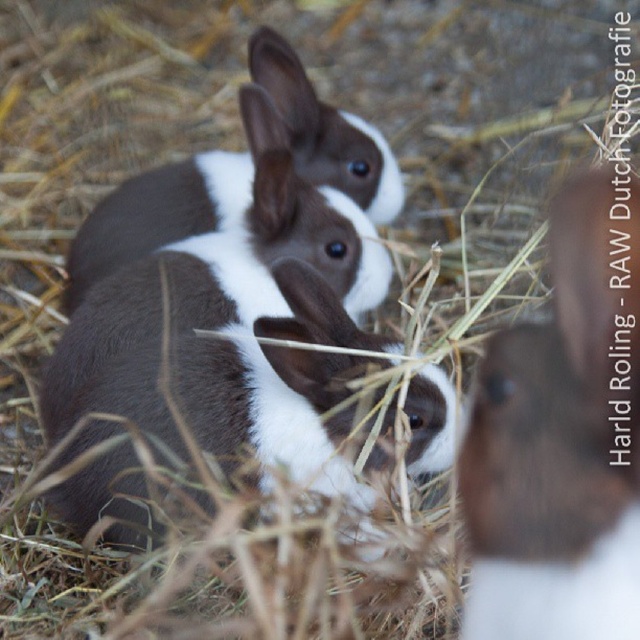
Question: Is brown fur rabbit at center positioned behind brown and white fur rabbit at center?

Choices:
 (A) yes
 (B) no

Answer: (B)

Question: Which of the following is the closest to the observer?

Choices:
 (A) (525, 355)
 (B) (145, 228)

Answer: (A)

Question: Is brown fur rabbit at center above brown and white fur rabbit at center?

Choices:
 (A) yes
 (B) no

Answer: (B)

Question: Which point appears closest to the camera in this image?

Choices:
 (A) (513, 330)
 (B) (144, 224)

Answer: (A)

Question: From the image, what is the correct spatial relationship of brown fur rabbit at center in relation to brown and white fur rabbit at center?

Choices:
 (A) below
 (B) above

Answer: (A)